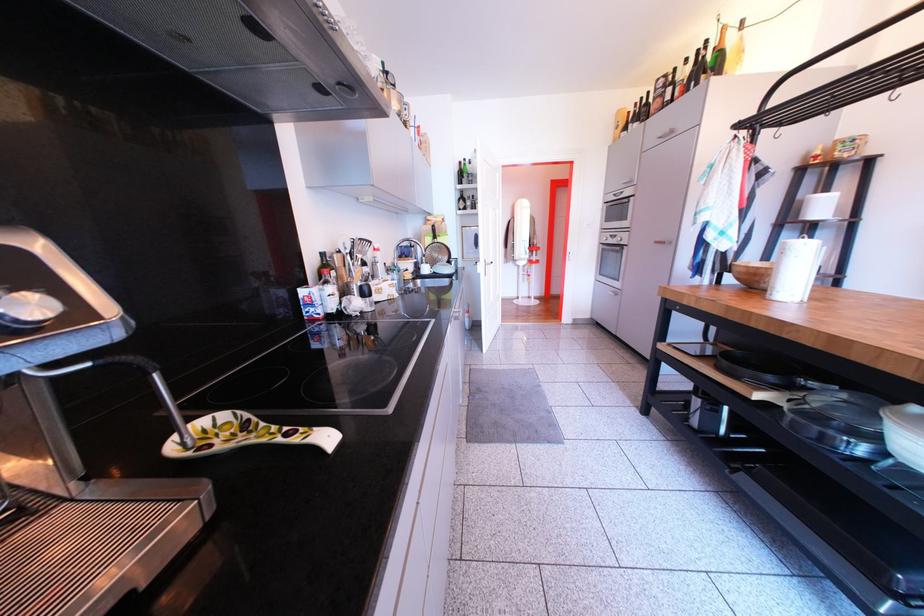
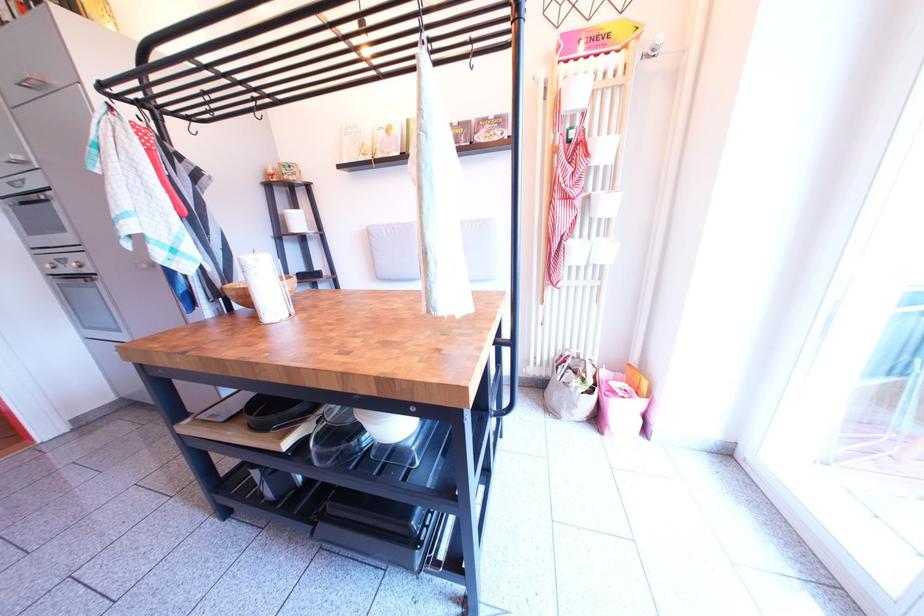
Locate, in the second image, the point that corresponds to the point at 746,275 in the first image.

(239, 299)